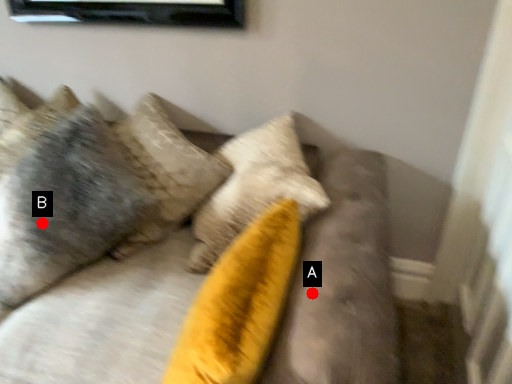
Question: Two points are circled on the image, labeled by A and B beside each circle. Which point is closer to the camera?

Choices:
 (A) A is closer
 (B) B is closer

Answer: (A)